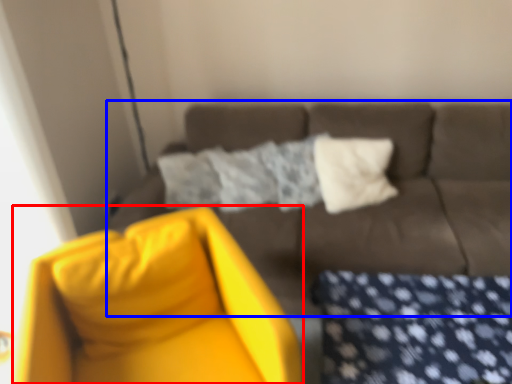
Question: Which point is further to the camera, swivel chair (highlighted by a red box) or studio couch (highlighted by a blue box)?

Choices:
 (A) swivel chair
 (B) studio couch

Answer: (B)